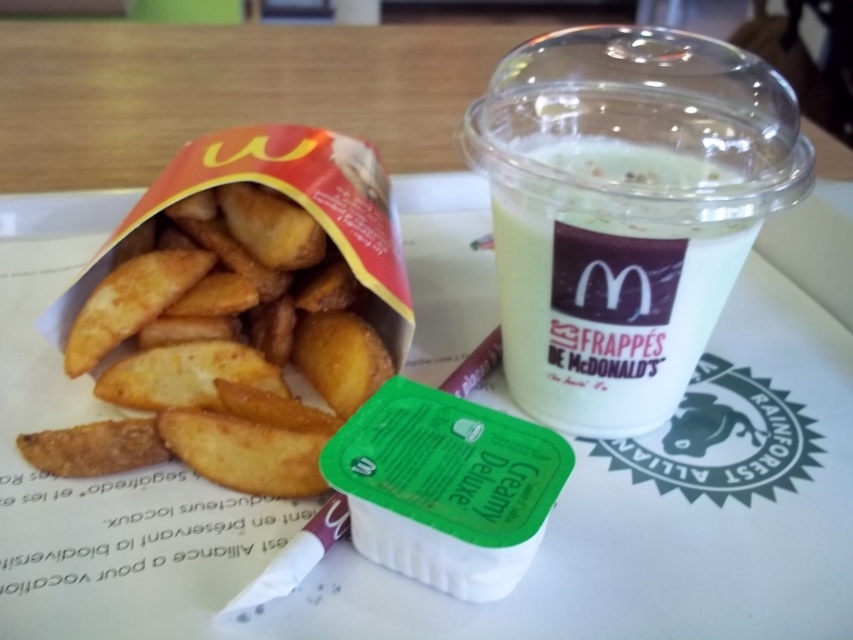
Who is more distant from viewer, (242, 188) or (660, 381)?

The point (242, 188) is more distant.

Is golden crispy fries at left behind white opaque cup at center?

Yes.

Find the location of a particular element. The width and height of the screenshot is (853, 640). golden crispy fries at left is located at coordinates (219, 356).